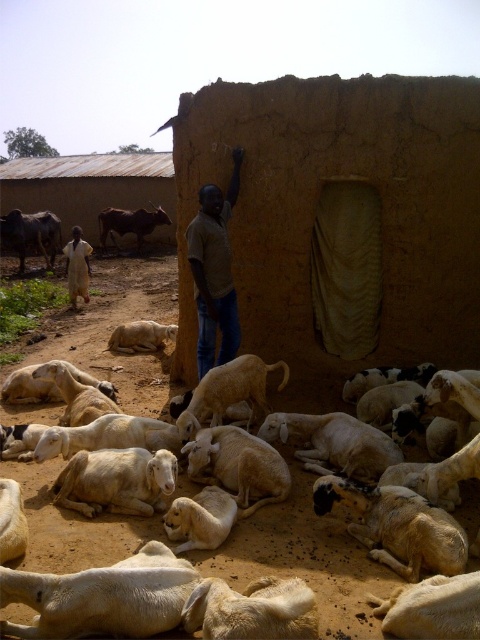
Can you confirm if white woolen sheep at center is wider than white woolen goat at lower left?

Correct, the width of white woolen sheep at center exceeds that of white woolen goat at lower left.

Can you confirm if white woolen sheep at center is smaller than white woolen goat at lower left?

No, white woolen sheep at center is not smaller than white woolen goat at lower left.

Does point (308, 493) come in front of point (140, 476)?

No, (308, 493) is further to viewer.

Where is `white woolen sheep at center`? white woolen sheep at center is located at coordinates (303, 557).

Is white woolen goat at center below light brown fabric dress at lower left?

Yes, white woolen goat at center is below light brown fabric dress at lower left.

Locate an element on the screen. The image size is (480, 640). white woolen goat at center is located at coordinates (141, 337).

Does point (172, 330) lie in front of point (69, 269)?

Yes, it is.

Find the location of a particular element. The width and height of the screenshot is (480, 640). white woolen goat at center is located at coordinates (141, 337).

Between matte brown shirt at center and white woolen goat at center, which one is positioned lower?

Positioned lower is white woolen goat at center.

Does matte brown shirt at center appear over white woolen goat at center?

Indeed, matte brown shirt at center is positioned over white woolen goat at center.

What are the coordinates of `matte brown shirt at center` in the screenshot? It's located at (215, 272).

You are a GUI agent. You are given a task and a screenshot of the screen. Output one action in this format:
    pyautogui.click(x=<x>, y=<y>)
    Task: Click on the matte brown shirt at center
    The image size is (480, 640).
    Given the screenshot: What is the action you would take?
    pyautogui.click(x=215, y=272)